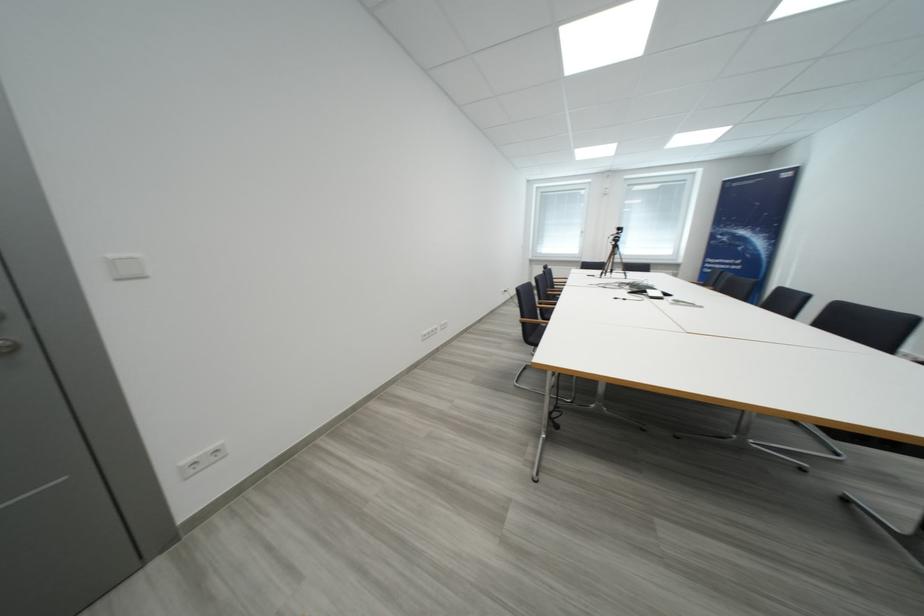
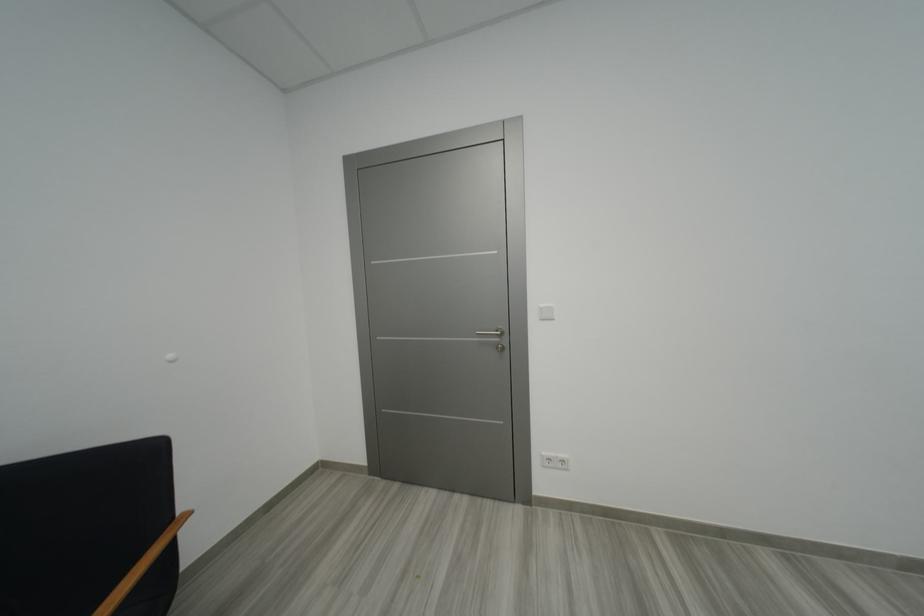
Locate, in the second image, the point that corresponds to (120,265) in the first image.

(548, 312)